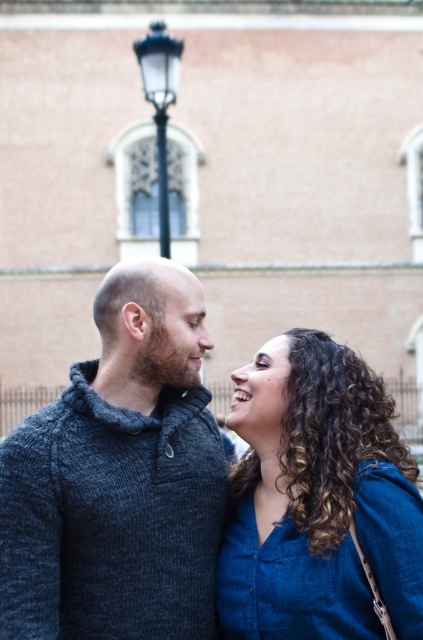
Question: Among these points, which one is nearest to the camera?

Choices:
 (A) click(38, 620)
 (B) click(419, 520)
 (C) click(161, 193)

Answer: (A)

Question: Can you confirm if dark gray knitted sweater at center is positioned to the right of black glass lamp post at upper center?

Choices:
 (A) yes
 (B) no

Answer: (A)

Question: Where is dark gray knitted sweater at center located in relation to blue denim shirt at lower right in the image?

Choices:
 (A) right
 (B) left

Answer: (B)

Question: Which object is farther from the camera taking this photo?

Choices:
 (A) blue denim shirt at lower right
 (B) dark gray knitted sweater at center
 (C) black glass lamp post at upper center

Answer: (C)

Question: Which is farther from the dark gray knitted sweater at center?

Choices:
 (A) black glass lamp post at upper center
 (B) blue denim shirt at lower right

Answer: (A)

Question: Is blue denim shirt at lower right positioned at the back of black glass lamp post at upper center?

Choices:
 (A) no
 (B) yes

Answer: (A)